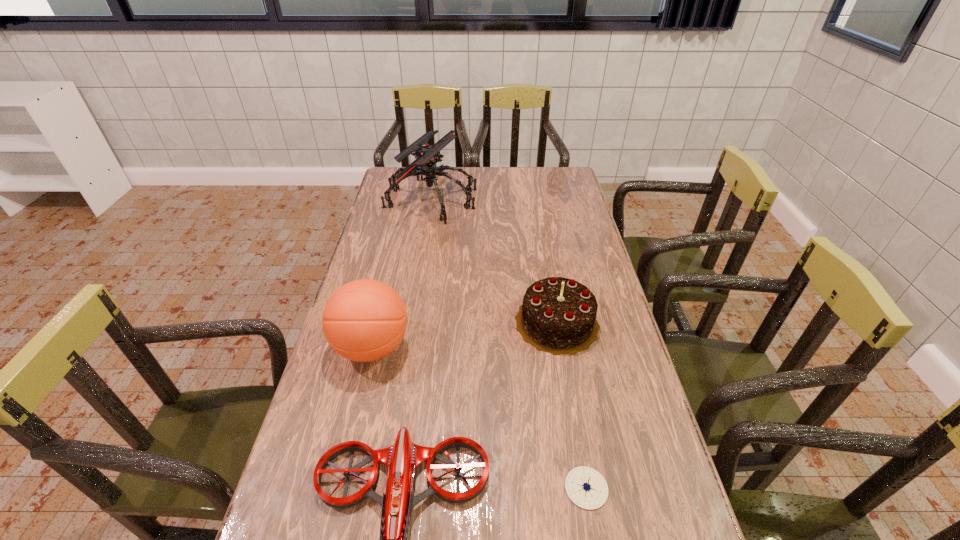
At what (x,y) coordinates should I click in order to perform the action: click on the taller drone. Please return your answer as a coordinate pair (x, y). Looking at the image, I should click on (427, 156).

Identify the location of the farthest object. (427, 156).

Locate an element on the screen. The height and width of the screenshot is (540, 960). basketball is located at coordinates (364, 320).

Identify the location of the third shortest object. This screenshot has height=540, width=960. (558, 315).

What are the coordinates of `compass` in the screenshot? It's located at (586, 487).

The image size is (960, 540). I want to click on free location located on the front of the farthest object, so click(x=416, y=292).

The image size is (960, 540). I want to click on vacant space located 0.120m on the right of the basketball, so click(x=454, y=347).

Where is `free spot located on the left of the birthday cake`? free spot located on the left of the birthday cake is located at coordinates (454, 322).

Locate an element on the screen. The image size is (960, 540). vacant space located on the left of the shortest object is located at coordinates (457, 488).

The width and height of the screenshot is (960, 540). In order to click on object present at the far edge in this screenshot , I will do `click(427, 156)`.